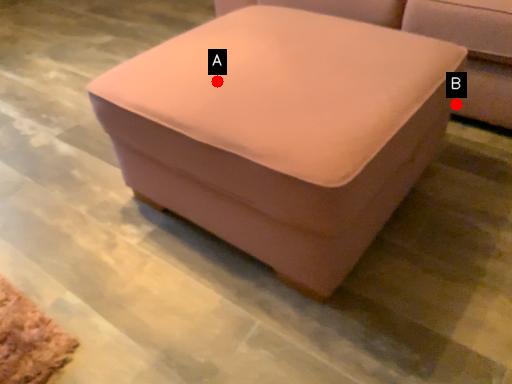
Question: Two points are circled on the image, labeled by A and B beside each circle. Which point is closer to the camera?

Choices:
 (A) A is closer
 (B) B is closer

Answer: (A)